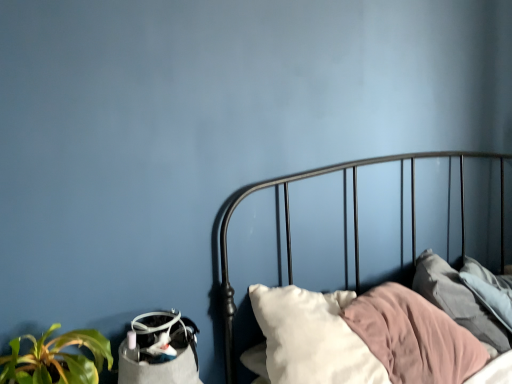
This screenshot has height=384, width=512. Describe the element at coordinates (57, 359) in the screenshot. I see `green leafy plant at lower left` at that location.

Identify the location of green leafy plant at lower left. (57, 359).

What is the approximate height of green leafy plant at lower left?

9.30 inches.

What is the approximate width of green leafy plant at lower left?

green leafy plant at lower left is 8.87 inches in width.

Locate an element on the screen. This screenshot has width=512, height=384. green leafy plant at lower left is located at coordinates (57, 359).